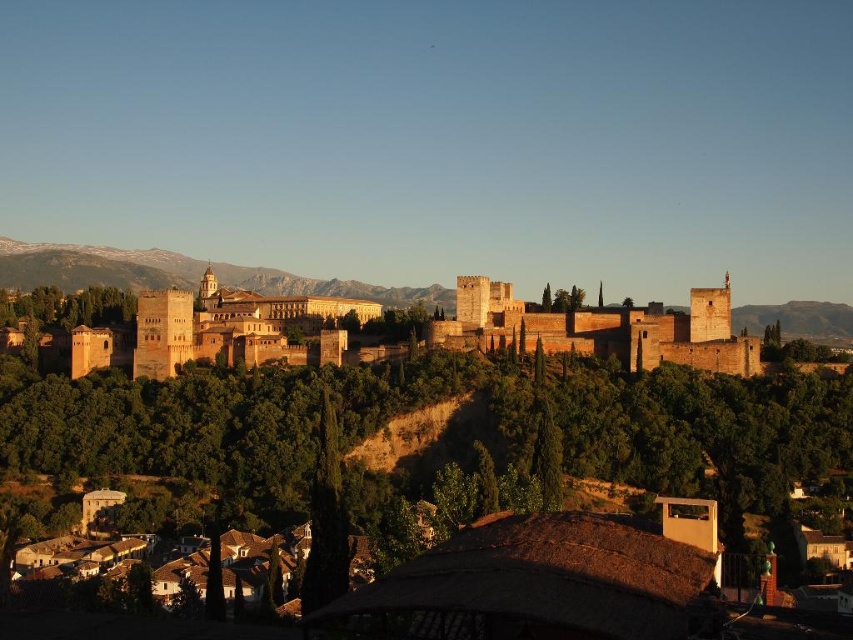
Question: Does green leafy tree at center appear under brown stone fort at center?

Choices:
 (A) yes
 (B) no

Answer: (A)

Question: Which object is positioned closest to the snowy rock formation at upper left?

Choices:
 (A) brown stone fort at center
 (B) green leafy tree at center

Answer: (A)

Question: Is brown stone fort at center bigger than snowy rock formation at upper left?

Choices:
 (A) no
 (B) yes

Answer: (A)

Question: Which is farther from the snowy rock formation at upper left?

Choices:
 (A) brown stone fort at center
 (B) green leafy tree at center

Answer: (B)

Question: Is brown stone fort at center in front of snowy rock formation at upper left?

Choices:
 (A) yes
 (B) no

Answer: (A)

Question: Which object is farther from the camera taking this photo?

Choices:
 (A) brown stone fort at center
 (B) green leafy tree at center
 (C) snowy rock formation at upper left

Answer: (C)